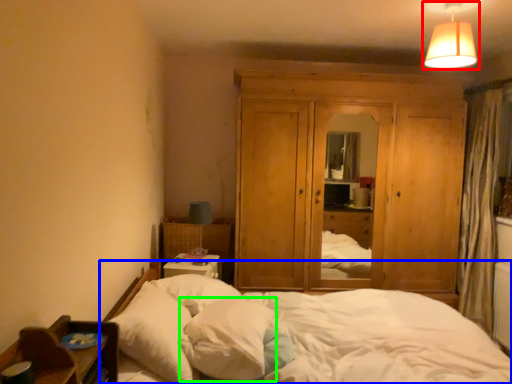
Question: Considering the real-world distances, which object is closest to lamp (highlighted by a red box)? bed (highlighted by a blue box) or pillow (highlighted by a green box).

Choices:
 (A) bed
 (B) pillow

Answer: (A)